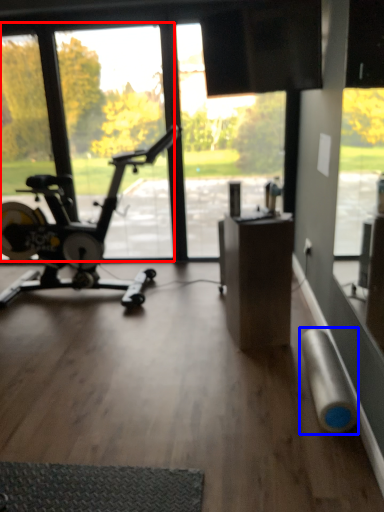
Question: Which object is further to the camera taking this photo, window screen (highlighted by a red box) or duct tape (highlighted by a blue box)?

Choices:
 (A) window screen
 (B) duct tape

Answer: (A)